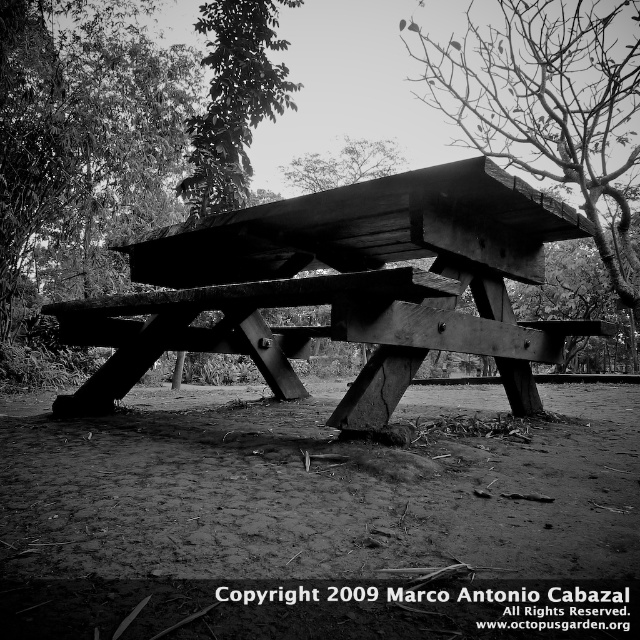
Is point (580, 474) farther from viewer compared to point (392, 204)?

That is False.

Is dirt/dry soil at lower center positioned at the back of wooden picnic table at center?

Yes.

Locate an element on the screen. dirt/dry soil at lower center is located at coordinates click(316, 490).

Find the location of a particular element. The height and width of the screenshot is (640, 640). dirt/dry soil at lower center is located at coordinates (316, 490).

Does dirt/dry soil at lower center have a larger size compared to bare wood tree at upper center?

No, dirt/dry soil at lower center is not bigger than bare wood tree at upper center.

Describe the element at coordinates (316, 490) in the screenshot. Image resolution: width=640 pixels, height=640 pixels. I see `dirt/dry soil at lower center` at that location.

Where is `dirt/dry soil at lower center`? The image size is (640, 640). dirt/dry soil at lower center is located at coordinates (316, 490).

Can you confirm if dirt/dry soil at lower center is taller than green leafy tree at upper center?

Incorrect, dirt/dry soil at lower center's height is not larger of green leafy tree at upper center's.

Describe the element at coordinates (316, 490) in the screenshot. The width and height of the screenshot is (640, 640). I see `dirt/dry soil at lower center` at that location.

Identify the location of dirt/dry soil at lower center. This screenshot has width=640, height=640. (316, 490).